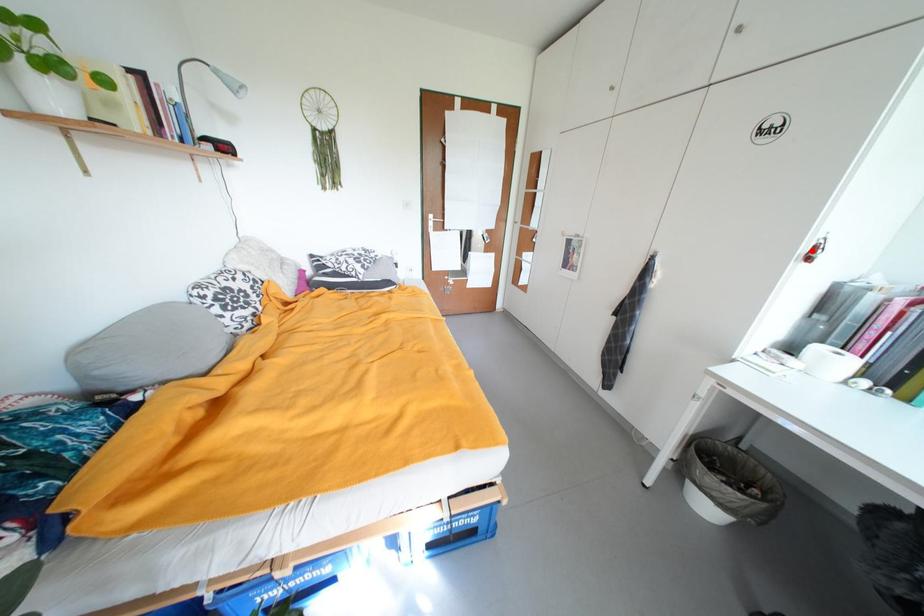
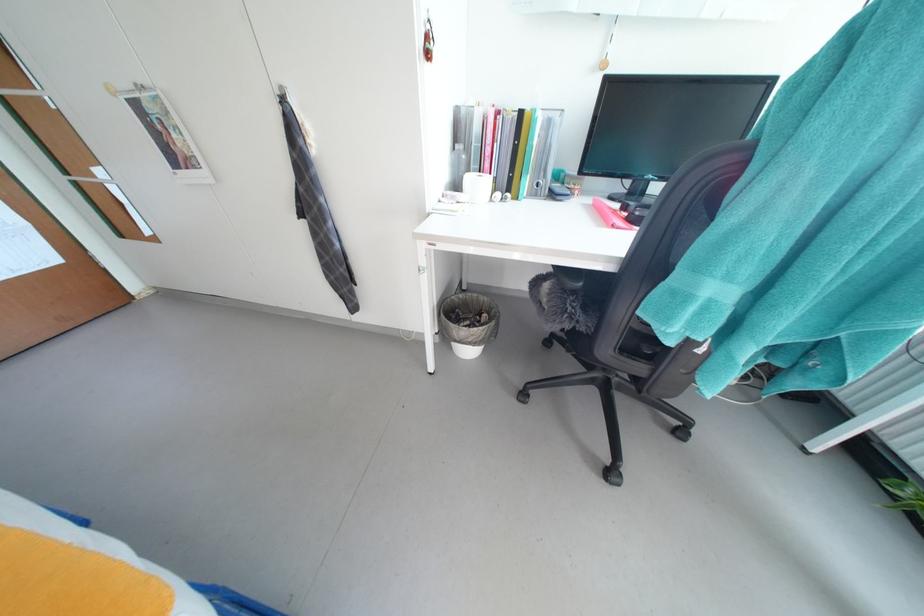
Find the pixel in the second image that matches the highlighted location in the first image.

(428, 41)